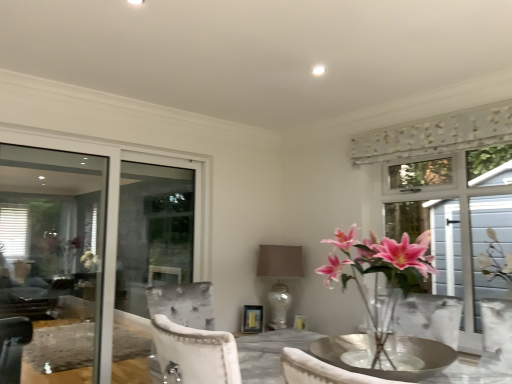
Question: Is white textured screen at right positioned beyond the bounds of clear glass window at left?

Choices:
 (A) yes
 (B) no

Answer: (A)

Question: Is white textured screen at right shorter than clear glass window at left?

Choices:
 (A) no
 (B) yes

Answer: (B)

Question: Can you confirm if white textured screen at right is smaller than clear glass window at left?

Choices:
 (A) no
 (B) yes

Answer: (B)

Question: Can you confirm if white textured screen at right is thinner than clear glass window at left?

Choices:
 (A) no
 (B) yes

Answer: (A)

Question: Is the depth of white textured screen at right less than that of clear glass window at left?

Choices:
 (A) yes
 (B) no

Answer: (A)

Question: From a real-world perspective, is white textured screen at right physically located above or below floral fabric curtain at upper right?

Choices:
 (A) below
 (B) above

Answer: (A)

Question: Considering the positions of point (494, 208) and point (381, 130), is point (494, 208) closer or farther from the camera than point (381, 130)?

Choices:
 (A) closer
 (B) farther

Answer: (B)

Question: In terms of width, does white textured screen at right look wider or thinner when compared to floral fabric curtain at upper right?

Choices:
 (A) wide
 (B) thin

Answer: (A)

Question: Is white textured screen at right situated inside floral fabric curtain at upper right or outside?

Choices:
 (A) inside
 (B) outside

Answer: (B)

Question: Is pink glass vase at center right bigger or smaller than clear glass window at left?

Choices:
 (A) small
 (B) big

Answer: (A)

Question: From the image's perspective, is pink glass vase at center right positioned above or below clear glass window at left?

Choices:
 (A) above
 (B) below

Answer: (A)

Question: Do you think pink glass vase at center right is within clear glass window at left, or outside of it?

Choices:
 (A) inside
 (B) outside

Answer: (B)

Question: Relative to clear glass window at left, is pink glass vase at center right in front or behind?

Choices:
 (A) front
 (B) behind

Answer: (A)

Question: Relative to pink glass vase at center right, is floral fabric curtain at upper right in front or behind?

Choices:
 (A) behind
 (B) front

Answer: (A)

Question: Considering the positions of point (475, 112) and point (419, 236), is point (475, 112) closer or farther from the camera than point (419, 236)?

Choices:
 (A) farther
 (B) closer

Answer: (B)